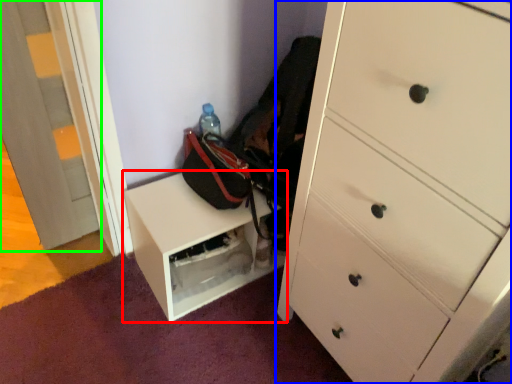
Question: Considering the real-world distances, which object is closest to furniture (highlighted by a red box)? chest of drawers (highlighted by a blue box) or door (highlighted by a green box).

Choices:
 (A) chest of drawers
 (B) door

Answer: (A)